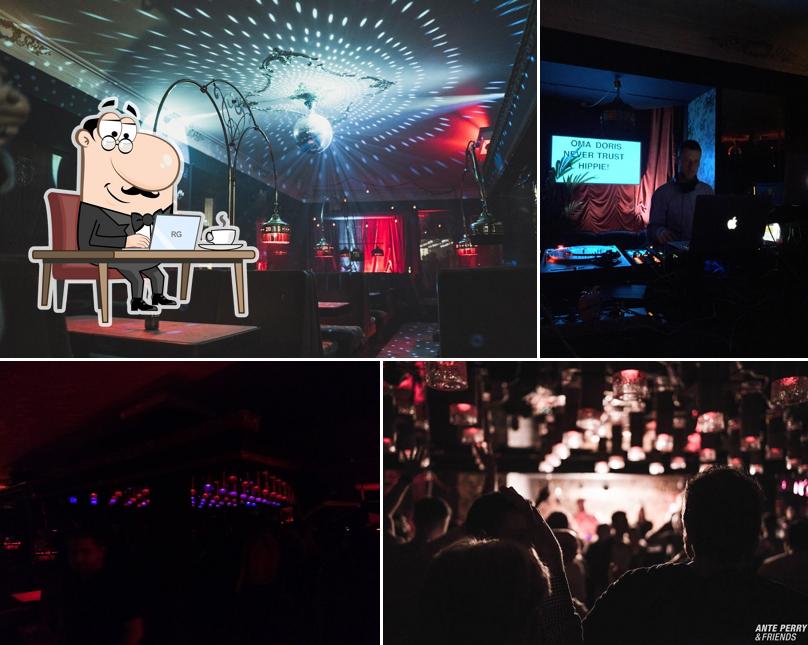
Find the location of a particular element. The height and width of the screenshot is (645, 808). laptop is located at coordinates (707, 220), (188, 226).